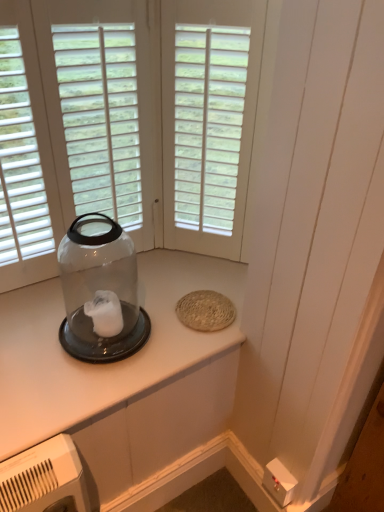
This screenshot has width=384, height=512. I want to click on vacant space in front of transparent glass jar at left, so click(73, 389).